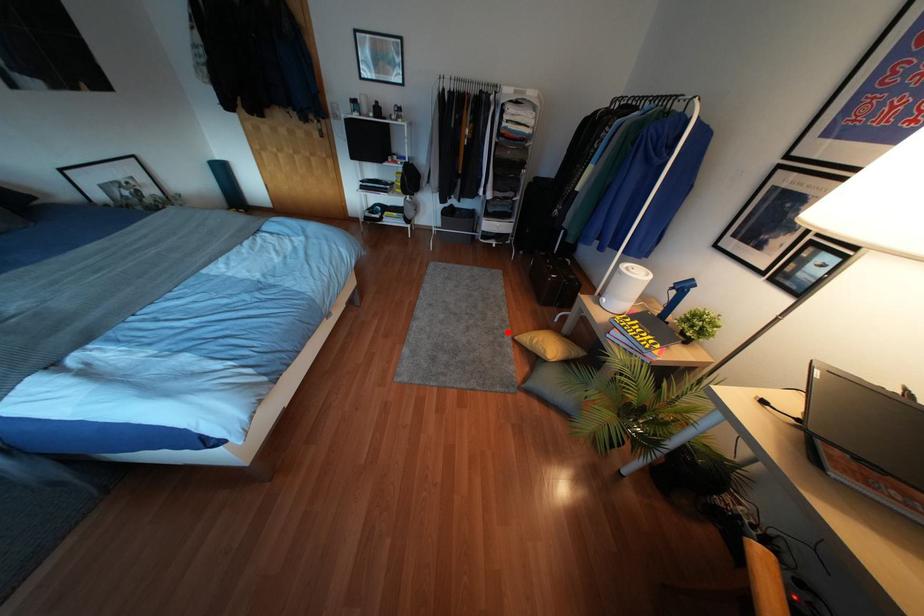
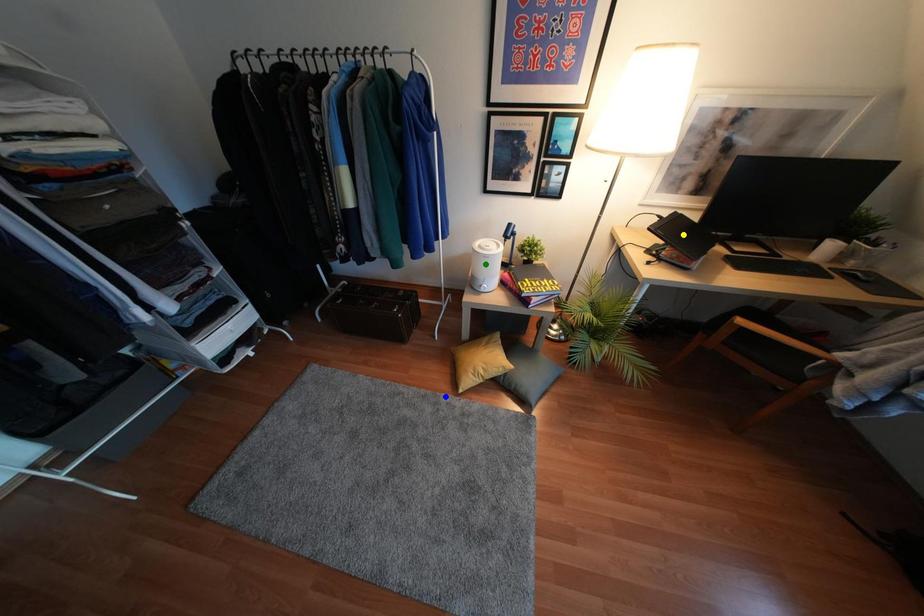
Question: I am providing you with two images of the same scene from different viewpoints. A red point is marked on the first image. You are given multiple points on the second image. Which spot in image 2 lines up with the point in image 1?

Choices:
 (A) yellow point
 (B) blue point
 (C) green point

Answer: (B)